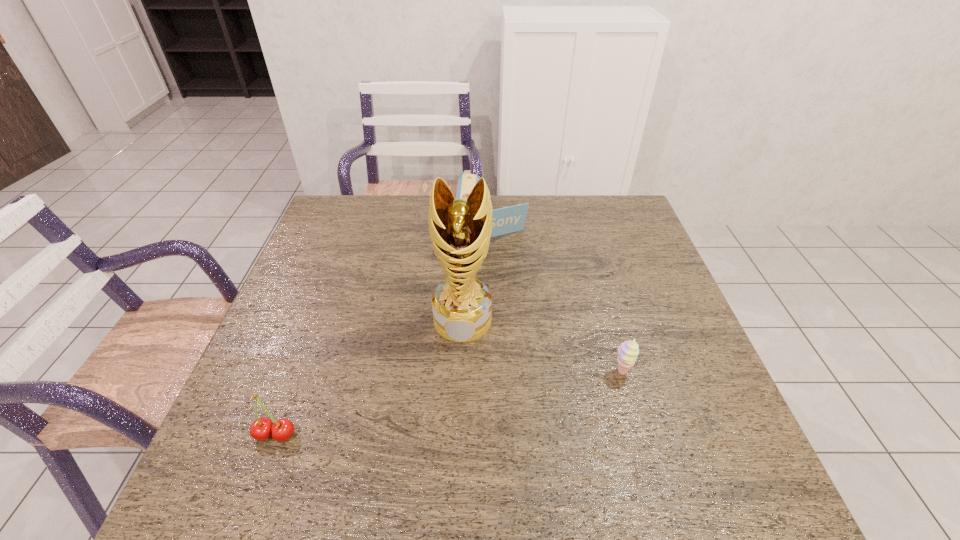
Where is `the nearest object`? The width and height of the screenshot is (960, 540). the nearest object is located at coordinates (261, 429).

Find the location of a particular element. This screenshot has width=960, height=540. the leftmost object is located at coordinates (261, 429).

You are a GUI agent. You are given a task and a screenshot of the screen. Output one action in this format:
    pyautogui.click(x=<x>, y=<y>)
    Task: Click on the sherbert
    
    Given the screenshot: What is the action you would take?
    pyautogui.click(x=627, y=352)

The image size is (960, 540). Identify the location of the second nearest object. (627, 352).

Where is `camcorder`? The image size is (960, 540). camcorder is located at coordinates (505, 220).

You are a GUI agent. You are given a task and a screenshot of the screen. Output one action in this format:
    pyautogui.click(x=<x>, y=<y>)
    Task: Click on the third shortest object
    The image size is (960, 540).
    Given the screenshot: What is the action you would take?
    pyautogui.click(x=505, y=220)

Locate an element on the screen. the third nearest object is located at coordinates (460, 230).

This screenshot has height=540, width=960. What are the coordinates of `award` in the screenshot? It's located at [x=460, y=230].

Find the location of a particular element. This screenshot has height=540, width=960. free space located 0.060m on the back of the rightmost object is located at coordinates (613, 344).

Find the location of a particular element. free space located on the side of the camcorder with the flip-out screen is located at coordinates (490, 303).